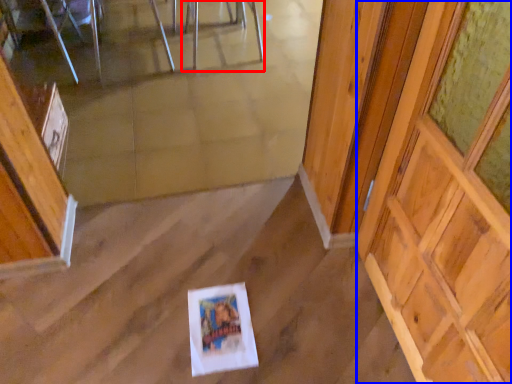
Question: Which object appears farthest to the camera in this image, chair (highlighted by a red box) or barn door (highlighted by a blue box)?

Choices:
 (A) chair
 (B) barn door

Answer: (A)